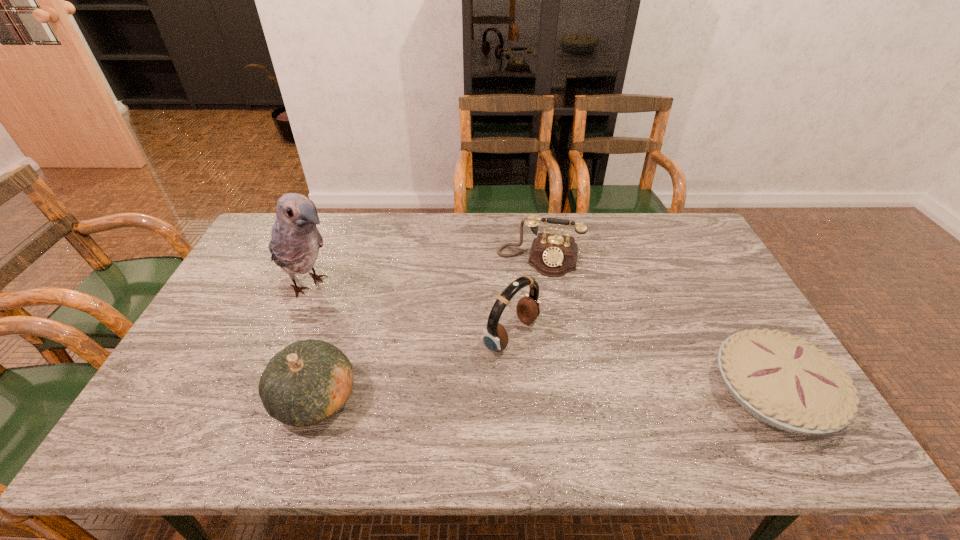
Find the location of a particular element. The image size is (960, 540). free space on the desktop that is between the gourd and the shortest object and is positioned on the dial of the telephone is located at coordinates (514, 395).

Where is `vacant spot on the desktop that is between the gourd and the rightmost object and is positioned on the front-facing side of the parrot`? The width and height of the screenshot is (960, 540). vacant spot on the desktop that is between the gourd and the rightmost object and is positioned on the front-facing side of the parrot is located at coordinates (481, 396).

This screenshot has width=960, height=540. In order to click on free spot on the desktop that is between the gourd and the rightmost object and is positioned on the ear cup of the headset in this screenshot , I will do `click(602, 394)`.